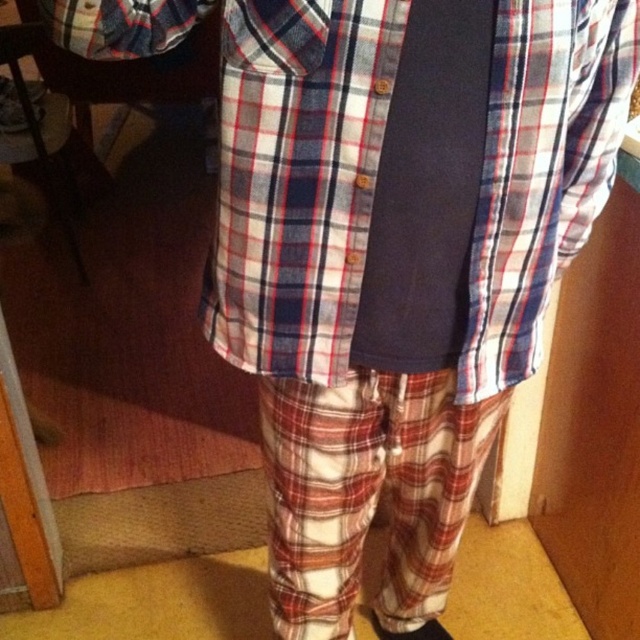
Question: Does plaid cotton shirt at center have a smaller size compared to dark blue fabric tie at center?

Choices:
 (A) yes
 (B) no

Answer: (B)

Question: Can you confirm if plaid cotton shirt at center is positioned to the right of dark blue fabric tie at center?

Choices:
 (A) yes
 (B) no

Answer: (B)

Question: Which point is closer to the camera taking this photo?

Choices:
 (A) (369, 337)
 (B) (225, 228)

Answer: (B)

Question: Which of the following is the farthest from the observer?

Choices:
 (A) (74, 38)
 (B) (387, 333)

Answer: (B)

Question: Can you confirm if plaid cotton shirt at center is positioned to the left of dark blue fabric tie at center?

Choices:
 (A) no
 (B) yes

Answer: (B)